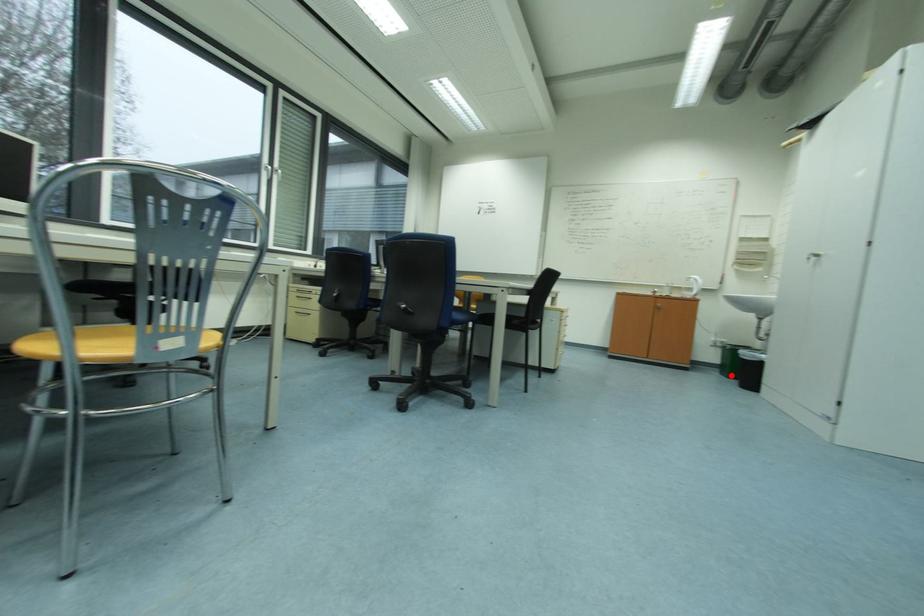
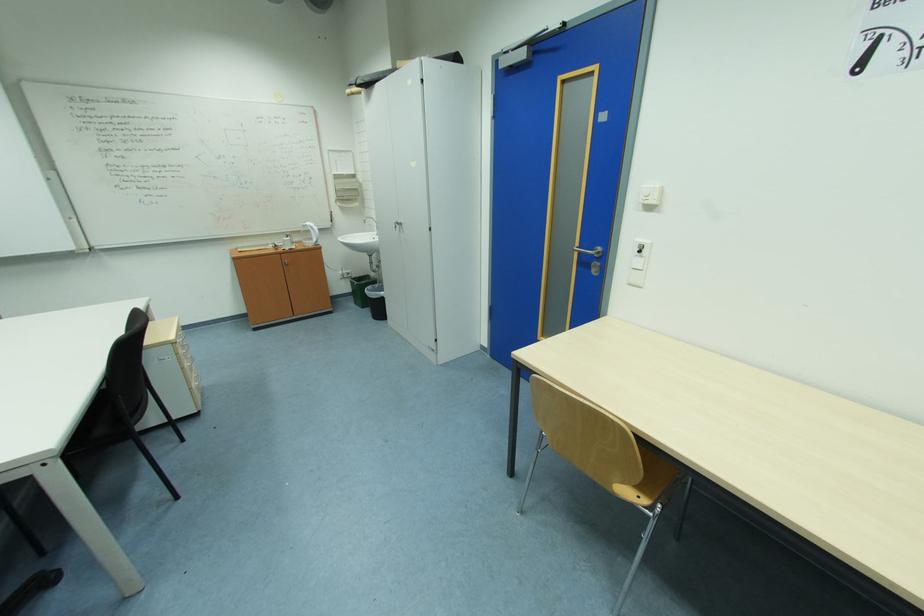
Question: I am providing you with two images of the same scene from different viewpoints. Given a red point in image1, look at the same physical point in image2. Is it:

Choices:
 (A) Closer to the viewpoint
 (B) Farther from the viewpoint

Answer: (B)